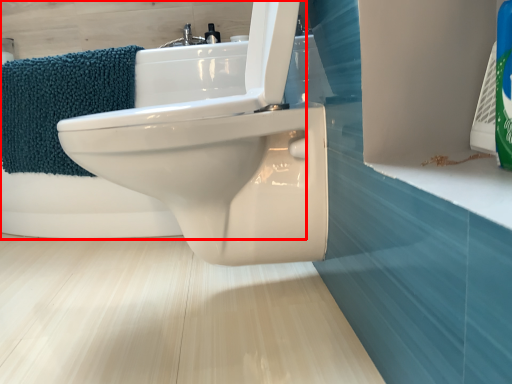
Question: Where is bath (annotated by the red box) located in relation to bath towel in the image?

Choices:
 (A) left
 (B) right

Answer: (B)